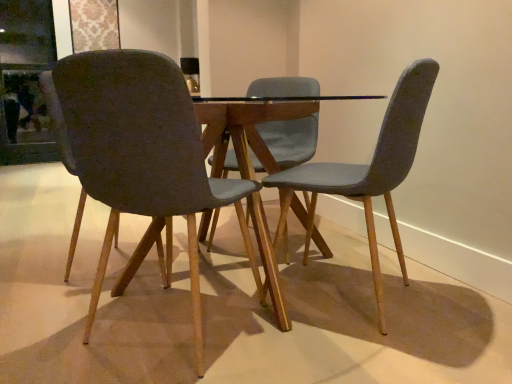
This screenshot has width=512, height=384. In order to click on space that is in front of textured gray chair at center, the second chair when ordered from left to right in this screenshot , I will do `click(365, 352)`.